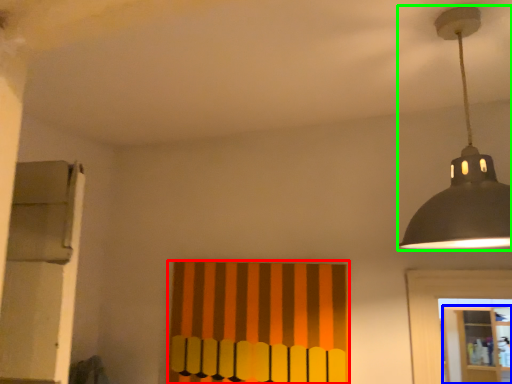
Question: Based on their relative distances, which object is nearer to curtain (highlighted by a red box)? Choose from shelf (highlighted by a blue box) and lamp (highlighted by a green box).

Choices:
 (A) shelf
 (B) lamp

Answer: (B)